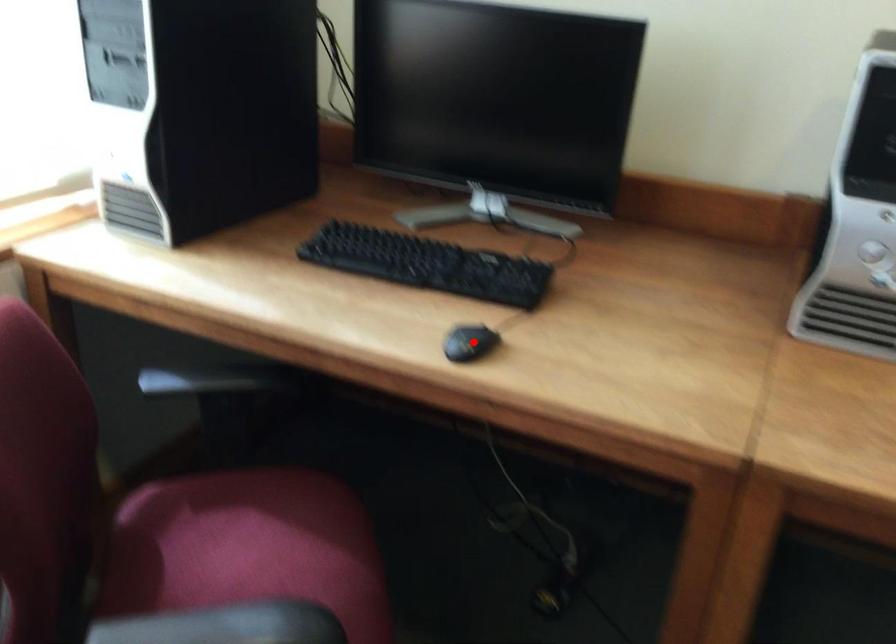
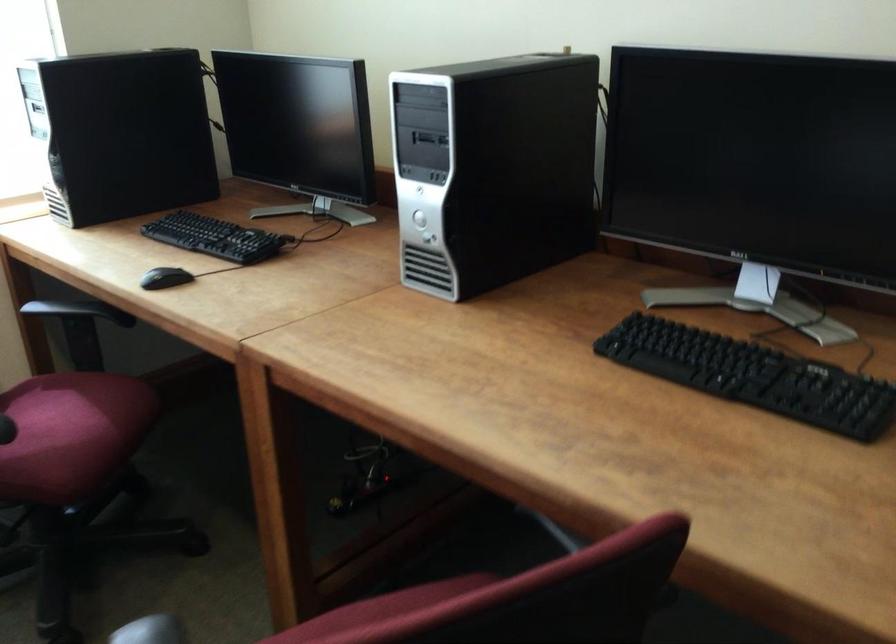
Locate, in the second image, the point that corresponds to the highlighted location in the first image.

(165, 278)